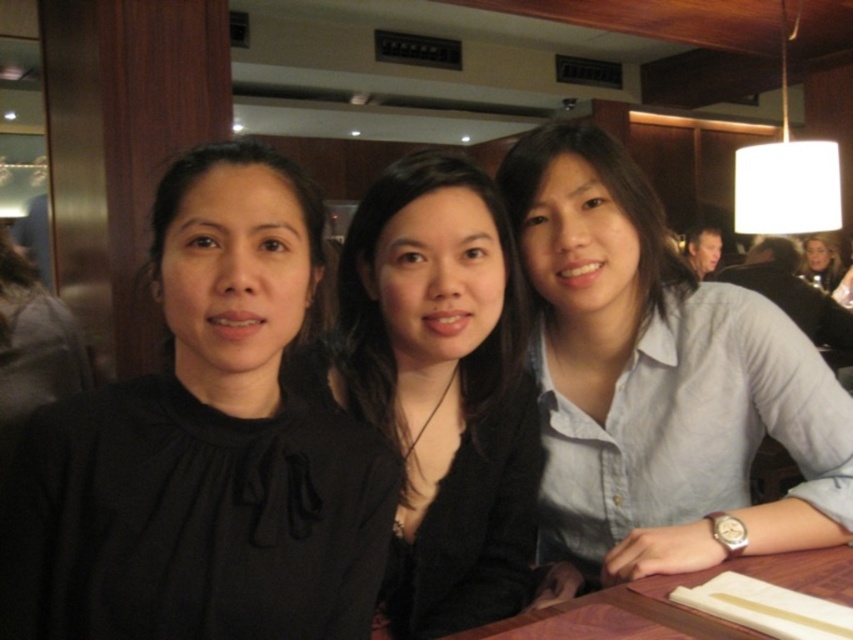
Question: Which point is farther to the camera?

Choices:
 (A) black matte shirt at center
 (B) blonde hair at upper right
 (C) light blue button-down shirt at right

Answer: (B)

Question: Can you confirm if light blue button-down shirt at right is thinner than black matte blazer at center?

Choices:
 (A) no
 (B) yes

Answer: (A)

Question: Does black matte shirt at center appear over brown wooden table at lower right?

Choices:
 (A) no
 (B) yes

Answer: (B)

Question: Which object is positioned closest to the black matte blazer at center?

Choices:
 (A) blonde hair at upper right
 (B) black matte shirt at center
 (C) light blue button-down shirt at right
 (D) brown wooden table at lower right

Answer: (C)

Question: Which point is farther to the camera?

Choices:
 (A) black matte shirt at center
 (B) brown wooden table at lower right
 (C) light blue button-down shirt at right

Answer: (C)

Question: Is black matte shirt at center positioned at the back of black matte blazer at center?

Choices:
 (A) no
 (B) yes

Answer: (A)